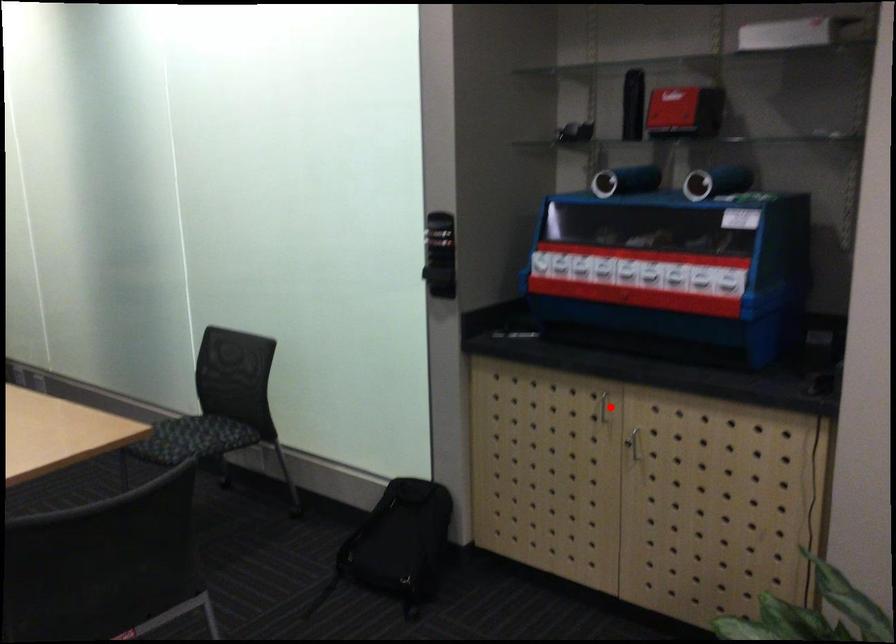
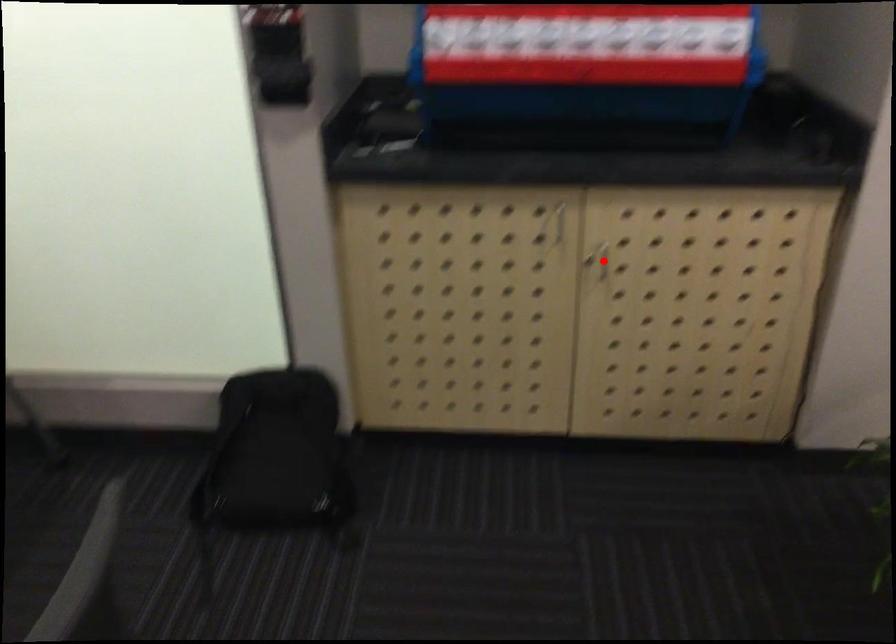
I am providing you with two images of the same scene from different viewpoints. A red point is marked on the first image and another point is marked on the second image. Does the point marked in image1 correspond to the same location as the one in image2?

No